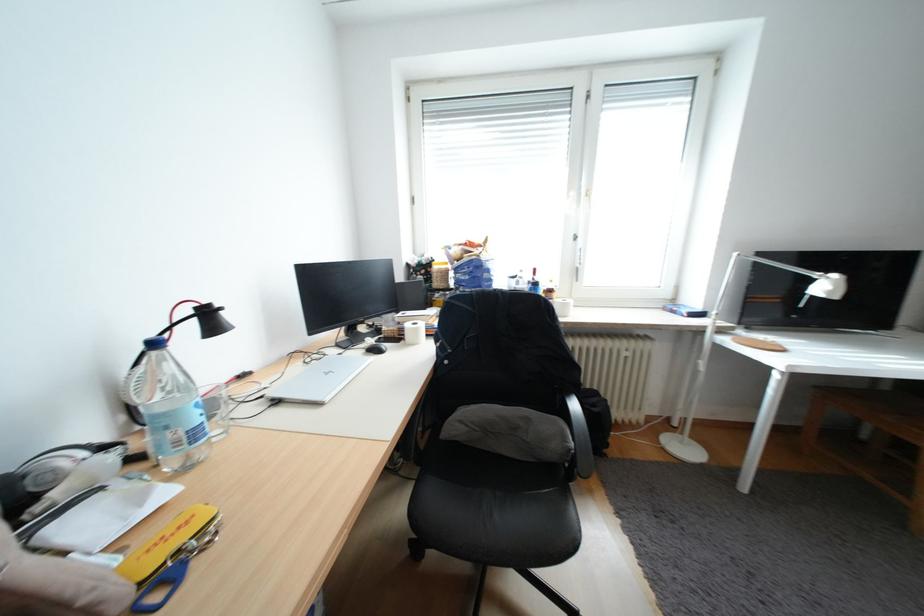
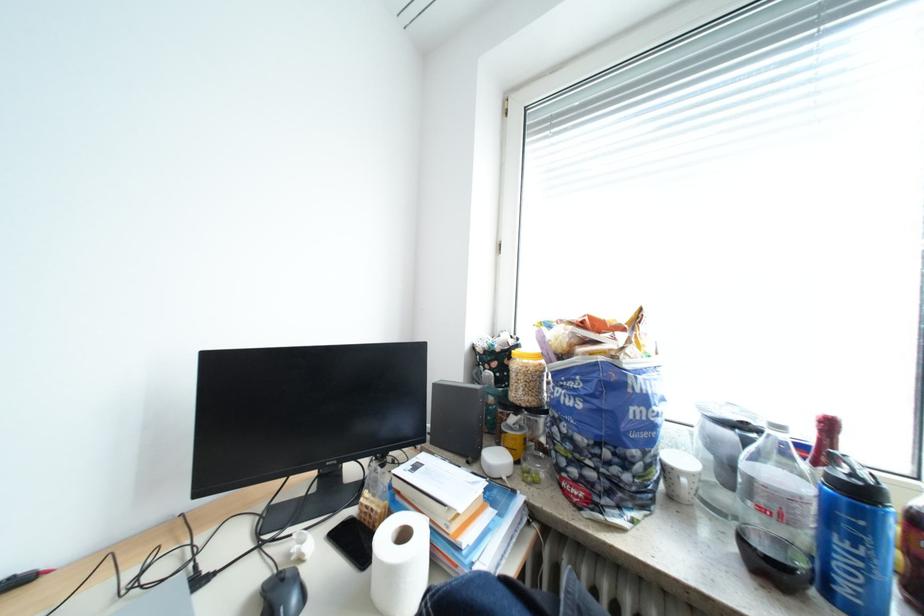
Find the pixel in the second image that matches point (548, 285) in the first image.

(873, 493)